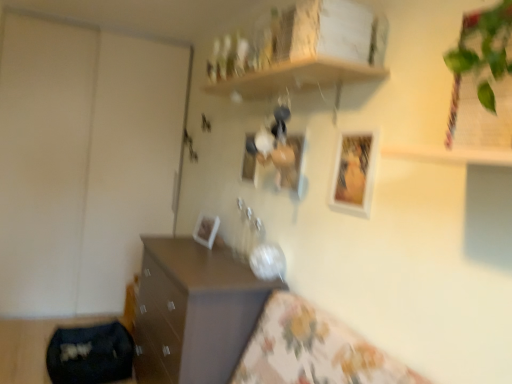
Consider the image. Measure the distance between matte white picture frame at center, which is the 2th picture frame in front-to-back order, and camera.

matte white picture frame at center, which is the 2th picture frame in front-to-back order, and camera are 5.96 feet apart.

This screenshot has width=512, height=384. I want to click on white glossy picture frame at upper center, positioned as the fourth picture frame in left-to-right order, so click(x=354, y=172).

Where is `wooden shelf at upper center`? wooden shelf at upper center is located at coordinates (295, 77).

This screenshot has height=384, width=512. What do you see at coordinates (485, 44) in the screenshot? I see `green leafy plant at upper right` at bounding box center [485, 44].

Find the location of a particular element. Image resolution: width=512 pixels, height=384 pixels. matte white picture frame at center, the second picture frame from the back is located at coordinates (249, 158).

Consider the image. Measure the distance between matte white picture frame at center, the second picture frame from the back, and camera.

matte white picture frame at center, the second picture frame from the back, and camera are 2.55 meters apart.

Locate an element on the screen. Image resolution: width=512 pixels, height=384 pixels. matte brown chest of drawers at lower left is located at coordinates (193, 311).

This screenshot has height=384, width=512. In order to click on matte white picture frame at center, acting as the 2th picture frame starting from the right in this screenshot , I will do point(289,162).

From the picture: Is matte brown chest of drawers at lower left wider or thinner than green leafy plant at upper right?

Considering their sizes, matte brown chest of drawers at lower left looks broader than green leafy plant at upper right.

Which of these two, matte brown chest of drawers at lower left or green leafy plant at upper right, is bigger?

matte brown chest of drawers at lower left.

Which object is positioned more to the right, matte brown chest of drawers at lower left or green leafy plant at upper right?

Positioned to the right is green leafy plant at upper right.

Is matte brown chest of drawers at lower left inside or outside of green leafy plant at upper right?

matte brown chest of drawers at lower left exists outside the volume of green leafy plant at upper right.

Is matte white picture frame at center, the third picture frame positioned from the left, with white glossy picture frame at upper center, placed as the 1th picture frame when sorted from right to left?

No, matte white picture frame at center, the third picture frame positioned from the left, is not beside white glossy picture frame at upper center, placed as the 1th picture frame when sorted from right to left.

Which point is more forward, (x=280, y=169) or (x=368, y=149)?

The point (x=368, y=149) is in front.

Is white glossy picture frame at upper center, acting as the fourth picture frame starting from the back, at the back of matte white picture frame at center, acting as the 2th picture frame starting from the right?

No, matte white picture frame at center, acting as the 2th picture frame starting from the right,'s orientation is not away from white glossy picture frame at upper center, acting as the fourth picture frame starting from the back.

Considering the sizes of matte white picture frame at center, which is the 2th picture frame in front-to-back order, and white glossy picture frame at upper center, positioned as the fourth picture frame in left-to-right order, in the image, is matte white picture frame at center, which is the 2th picture frame in front-to-back order, wider or thinner than white glossy picture frame at upper center, positioned as the fourth picture frame in left-to-right order,?

Clearly, matte white picture frame at center, which is the 2th picture frame in front-to-back order, has more width compared to white glossy picture frame at upper center, positioned as the fourth picture frame in left-to-right order.

How far apart are green leafy plant at upper right and wooden shelf at upper center?

green leafy plant at upper right and wooden shelf at upper center are 34.56 inches apart.

Is there a large distance between green leafy plant at upper right and wooden shelf at upper center?

Actually, green leafy plant at upper right and wooden shelf at upper center are a little close together.

Is point (471, 58) farther from viewer compared to point (305, 78)?

No, (471, 58) is closer to viewer.

Considering the sizes of objects green leafy plant at upper right and wooden shelf at upper center in the image provided, who is bigger, green leafy plant at upper right or wooden shelf at upper center?

Bigger between the two is wooden shelf at upper center.

Can you confirm if white glossy picture frame at upper center, acting as the fourth picture frame starting from the back, is shorter than green leafy plant at upper right?

Yes.

Measure the distance between white glossy picture frame at upper center, positioned as the fourth picture frame in left-to-right order, and green leafy plant at upper right.

white glossy picture frame at upper center, positioned as the fourth picture frame in left-to-right order, is 28.04 inches from green leafy plant at upper right.

Is white glossy picture frame at upper center, positioned as the fourth picture frame in left-to-right order, touching green leafy plant at upper right?

No.

From the image's perspective, starting from the green leafy plant at upper right, which picture frame is the 3rd one below? Please provide its 2D coordinates.

[(354, 172)]

Can you tell me how much matte white picture frame at center, the second picture frame from the back, and white plastic picture frame at center, the 1th picture frame positioned from the left, differ in facing direction?

matte white picture frame at center, the second picture frame from the back, and white plastic picture frame at center, the 1th picture frame positioned from the left, are facing 4.87 degrees away from each other.

From the image's perspective, is matte white picture frame at center, marked as the third picture frame in a front-to-back arrangement, on top of white plastic picture frame at center, which is the 1th picture frame from back to front?

Indeed, from the image's perspective, matte white picture frame at center, marked as the third picture frame in a front-to-back arrangement, is shown above white plastic picture frame at center, which is the 1th picture frame from back to front.

Is matte white picture frame at center, the 2th picture frame viewed from the left, directly adjacent to white plastic picture frame at center, the 1th picture frame positioned from the left?

matte white picture frame at center, the 2th picture frame viewed from the left, and white plastic picture frame at center, the 1th picture frame positioned from the left, are clearly separated.

Which point is more forward, [246,171] or [201,219]?

The point [246,171] is more forward.

Is the surface of white glossy picture frame at upper center, acting as the fourth picture frame starting from the back, in direct contact with matte white picture frame at center, which is the 3th picture frame from back to front?

There is a gap between white glossy picture frame at upper center, acting as the fourth picture frame starting from the back, and matte white picture frame at center, which is the 3th picture frame from back to front.

Between point (372, 187) and point (298, 170), which one is positioned behind?

The point (298, 170) is farther from the camera.

Does white glossy picture frame at upper center, the 1th picture frame when ordered from front to back, have a larger size compared to matte white picture frame at center, which is the 3th picture frame from back to front?

Actually, white glossy picture frame at upper center, the 1th picture frame when ordered from front to back, might be smaller than matte white picture frame at center, which is the 3th picture frame from back to front.

Locate an element on the screen. The image size is (512, 384). picture frame to the right of matte white picture frame at center, acting as the 2th picture frame starting from the right is located at coordinates (354, 172).

Measure the distance from matte brown chest of drawers at lower left to white glossy picture frame at upper center, the 1th picture frame when ordered from front to back.

matte brown chest of drawers at lower left is 35.92 inches from white glossy picture frame at upper center, the 1th picture frame when ordered from front to back.

From a real-world perspective, which is physically above, matte brown chest of drawers at lower left or white glossy picture frame at upper center, acting as the fourth picture frame starting from the back?

white glossy picture frame at upper center, acting as the fourth picture frame starting from the back, from a real-world perspective.

Is matte brown chest of drawers at lower left oriented towards white glossy picture frame at upper center, positioned as the fourth picture frame in left-to-right order?

No, matte brown chest of drawers at lower left is not oriented towards white glossy picture frame at upper center, positioned as the fourth picture frame in left-to-right order.

Is matte brown chest of drawers at lower left next to white glossy picture frame at upper center, positioned as the fourth picture frame in left-to-right order?

No, matte brown chest of drawers at lower left is not making contact with white glossy picture frame at upper center, positioned as the fourth picture frame in left-to-right order.

The width and height of the screenshot is (512, 384). I want to click on the chest of drawers that is behind the green leafy plant at upper right, so click(193, 311).

The width and height of the screenshot is (512, 384). Identify the location of the 1st picture frame located beneath the matte white picture frame at center, the third picture frame positioned from the left (from a real-world perspective). (354, 172).

When comparing their distances from white glossy picture frame at upper center, positioned as the fourth picture frame in left-to-right order, does wooden shelf at upper center or white plastic picture frame at center, marked as the 4th picture frame in a front-to-back arrangement, seem closer?

wooden shelf at upper center lies closer to white glossy picture frame at upper center, positioned as the fourth picture frame in left-to-right order, than the other object.

From the image, which object appears to be nearer to matte brown chest of drawers at lower left, green leafy plant at upper right or white glossy picture frame at upper center, acting as the fourth picture frame starting from the back?

Among the two, white glossy picture frame at upper center, acting as the fourth picture frame starting from the back, is located nearer to matte brown chest of drawers at lower left.

Based on their spatial positions, is white plastic picture frame at center, marked as the 4th picture frame in a front-to-back arrangement, or white glossy picture frame at upper center, the 1th picture frame when ordered from front to back, further from matte brown chest of drawers at lower left?

Among the two, white glossy picture frame at upper center, the 1th picture frame when ordered from front to back, is located further to matte brown chest of drawers at lower left.

Considering their positions, is white glossy picture frame at upper center, the 1th picture frame when ordered from front to back, positioned closer to matte white picture frame at center, which is the 2th picture frame in front-to-back order, than matte white picture frame at center, marked as the third picture frame in a front-to-back arrangement?

Based on the image, white glossy picture frame at upper center, the 1th picture frame when ordered from front to back, appears to be nearer to matte white picture frame at center, which is the 2th picture frame in front-to-back order.

Considering their positions, is white plastic picture frame at center, marked as the 4th picture frame in a front-to-back arrangement, positioned further to matte white picture frame at center, the 2th picture frame viewed from the left, than green leafy plant at upper right?

green leafy plant at upper right is positioned further to the anchor matte white picture frame at center, the 2th picture frame viewed from the left.

From the image, which object appears to be nearer to white plastic picture frame at center, the 1th picture frame positioned from the left, matte white picture frame at center, the 2th picture frame viewed from the left, or green leafy plant at upper right?

matte white picture frame at center, the 2th picture frame viewed from the left, lies closer to white plastic picture frame at center, the 1th picture frame positioned from the left, than the other object.

Looking at the image, which one is located closer to green leafy plant at upper right, matte white picture frame at center, the third picture frame positioned from the left, or wooden shelf at upper center?

wooden shelf at upper center is closer to green leafy plant at upper right.

Estimate the real-world distances between objects in this image. Which object is further from matte brown chest of drawers at lower left, matte white picture frame at center, acting as the 2th picture frame starting from the right, or green leafy plant at upper right?

Based on the image, green leafy plant at upper right appears to be further to matte brown chest of drawers at lower left.

Locate an element on the screen. The width and height of the screenshot is (512, 384). chest of drawers between white glossy picture frame at upper center, acting as the fourth picture frame starting from the back, and white plastic picture frame at center, which is the 1th picture frame from back to front, along the z-axis is located at coordinates point(193,311).

This screenshot has height=384, width=512. Identify the location of picture frame between matte white picture frame at center, which is the 2th picture frame in front-to-back order, and white plastic picture frame at center, which is the 1th picture frame from back to front, in the front-back direction. (249, 158).

This screenshot has width=512, height=384. Identify the location of picture frame located between green leafy plant at upper right and matte white picture frame at center, which is the 3th picture frame from back to front, in the depth direction. (354, 172).

At what (x,y) coordinates should I click in order to perform the action: click on shelf between green leafy plant at upper right and matte white picture frame at center, the 2th picture frame viewed from the left, in the front-back direction. Please return your answer as a coordinate pair (x, y). The height and width of the screenshot is (384, 512). Looking at the image, I should click on (295, 77).